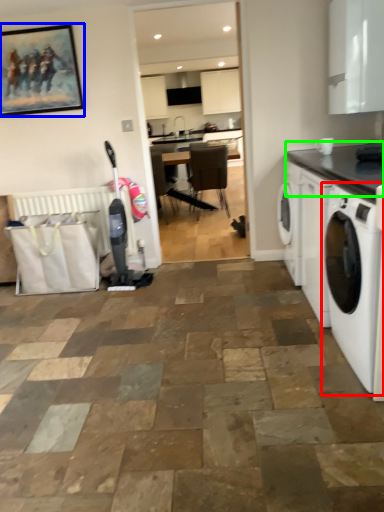
Question: Estimate the real-world distances between objects in this image. Which object is farther from washing machine (highlighted by a red box), picture frame (highlighted by a blue box) or countertop (highlighted by a green box)?

Choices:
 (A) picture frame
 (B) countertop

Answer: (A)